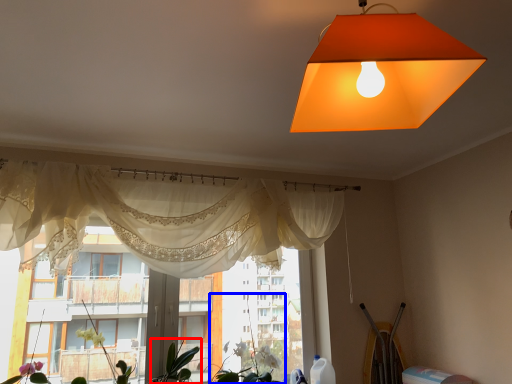
Question: Which of the following is the closest to the observer, plant (highlighted by a red box) or plant (highlighted by a blue box)?

Choices:
 (A) plant
 (B) plant

Answer: (A)